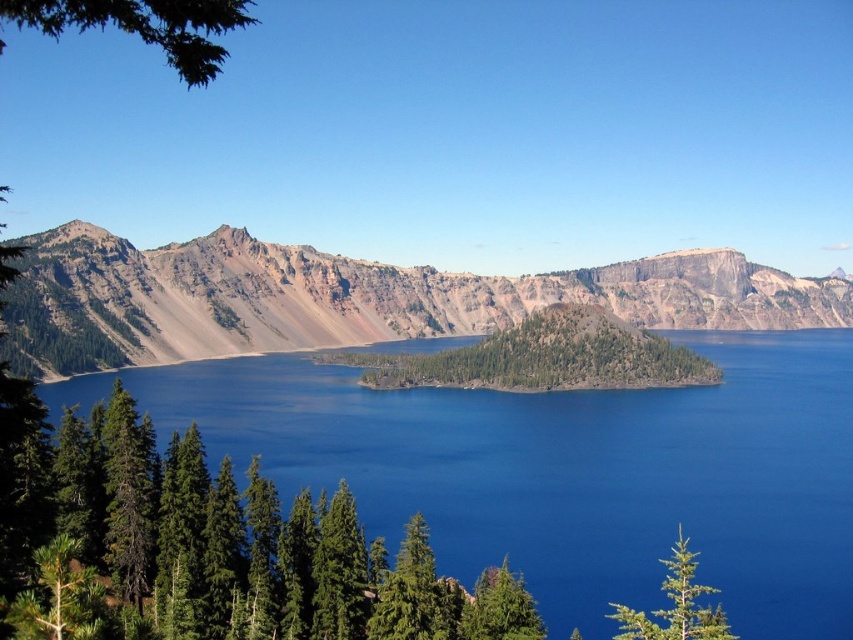
You are a hiker standing at the edge of Crater Lake and notice two green matte trees in the foreground. Which of the two trees, the green matte tree at lower right or the green matte tree at lower center, is closer to you?

The green matte tree at lower right is bigger than the green matte tree at lower center, so the green matte tree at lower right is closer to you because larger objects in the foreground appear bigger than those further away.